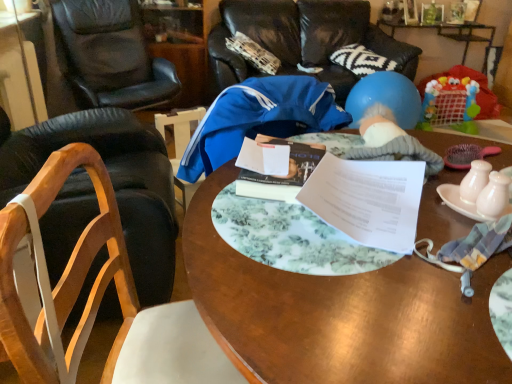
Question: Is blue rubber balloon at center wider or thinner than blue rubber ball at upper right?

Choices:
 (A) thin
 (B) wide

Answer: (B)

Question: From a real-world perspective, is blue rubber balloon at center physically located above or below blue rubber ball at upper right?

Choices:
 (A) below
 (B) above

Answer: (A)

Question: Which object is positioned farthest from the blue rubber ball at upper right?

Choices:
 (A) blue fabric chair at upper center, arranged as the 1th chair when viewed from the back
 (B) green glass bottle at upper right
 (C) blue rubber balloon at center
 (D) wooden chair at left, placed as the fourth chair when sorted from back to front
 (E) pink ceramic plate at right

Answer: (D)

Question: Estimate the real-world distances between objects in this image. Which object is farther from the wooden table at center?

Choices:
 (A) blue rubber ball at upper right
 (B) white paper at center
 (C) blue rubber balloon at center
 (D) hardcover book at center
 (E) green glass bottle at upper right

Answer: (E)